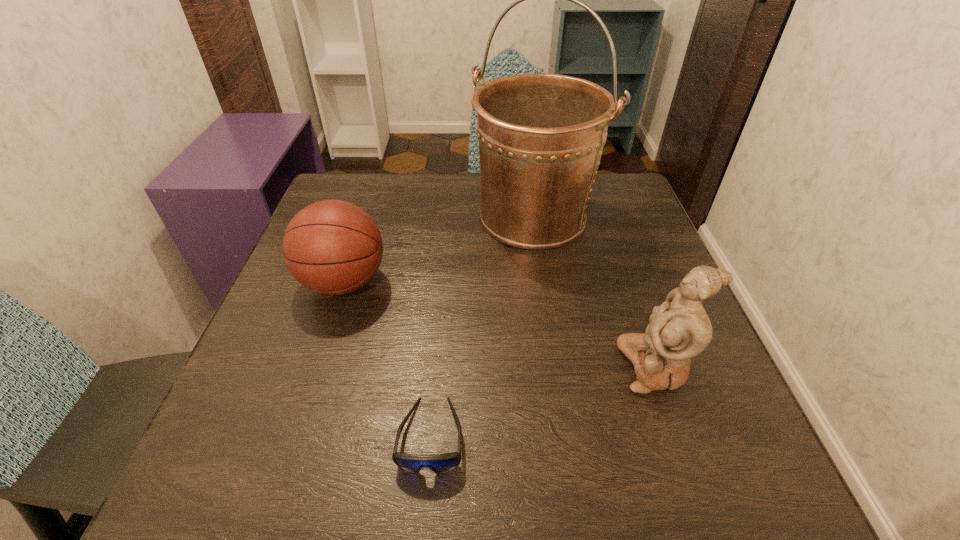
Find the location of a particular element. The image size is (960, 540). blank area at the left edge is located at coordinates (316, 407).

Where is `free space at the right edge of the desktop`? The image size is (960, 540). free space at the right edge of the desktop is located at coordinates (594, 234).

This screenshot has width=960, height=540. I want to click on blank space at the far right corner, so click(x=617, y=212).

Image resolution: width=960 pixels, height=540 pixels. In order to click on unoccupied area between the tallest object and the nearest object in this screenshot , I will do `click(482, 326)`.

The image size is (960, 540). I want to click on vacant area between the shortest object and the third shortest object, so click(x=543, y=401).

The height and width of the screenshot is (540, 960). I want to click on free space between the basketball and the tallest object, so click(x=439, y=249).

Identify the location of vacant area that lies between the tallest object and the basketball. (x=439, y=249).

Where is `free area in between the tallest object and the sunglasses`? free area in between the tallest object and the sunglasses is located at coordinates (482, 326).

Identify the location of free space between the third shortest object and the bucket. The image size is (960, 540). tap(594, 292).

Where is `empty location between the bucket and the third shortest object`? empty location between the bucket and the third shortest object is located at coordinates (594, 292).